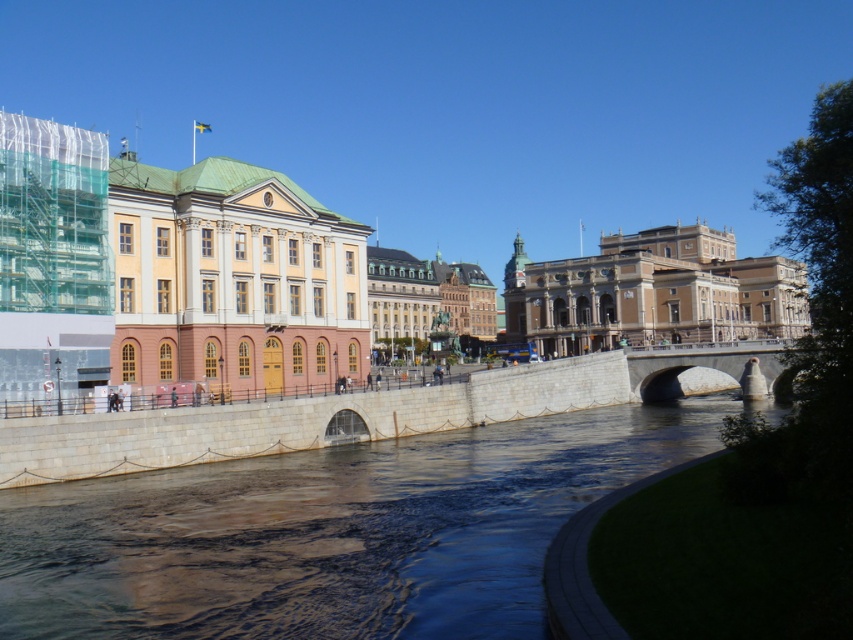
You are a photographer standing at the edge of the river in the urban scene. You want to capture a closeup shot of the clear water at center. Given that your camera can focus on objects up to 25 meters away, will you be able to take the photo without moving closer?

The clear water at center is 31.34 meters away from the camera, which is beyond the camera focus limit of 25 meters. Therefore, you cannot take the photo without moving closer.

You are a city planner reviewing a map of the city. You need to locate the beige stone building at center. Where is it located on the map?

The beige stone building at center is located at point coordinates of (653, 292).

You are a city planner assessing the riverfront area. You need to determine if the beige stone building at center can be partially demolished to widen the gray stone bridge at center. Based on their current widths, is this feasible?

The beige stone building at center is wider than the gray stone bridge at center. Therefore, there is potential to demolish part of the building to widen the bridge, provided other structural and legal considerations are met.